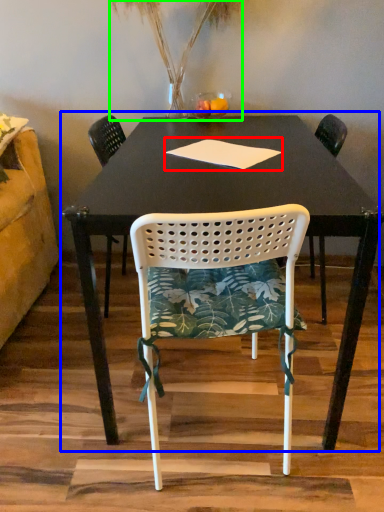
Question: Which object is the farthest from notepad (highlighted by a red box)? Choose among these: table (highlighted by a blue box) or plant (highlighted by a green box).

Choices:
 (A) table
 (B) plant

Answer: (B)